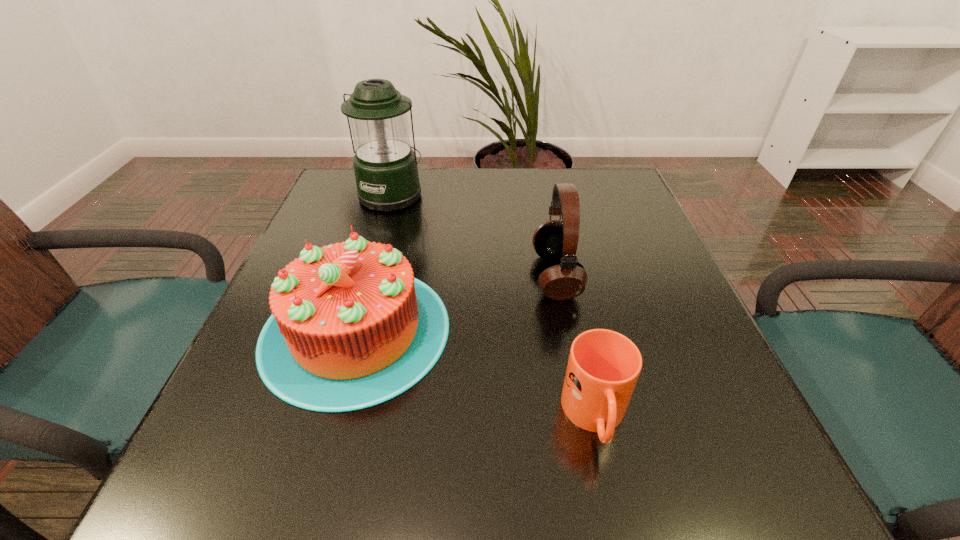
Where is `the tallest object`? the tallest object is located at coordinates (385, 166).

This screenshot has height=540, width=960. Find the location of `lantern`. lantern is located at coordinates pos(385,166).

Locate an element on the screen. headset is located at coordinates (565, 278).

Where is `cake`? The width and height of the screenshot is (960, 540). cake is located at coordinates (351, 328).

Locate an element on the screen. The height and width of the screenshot is (540, 960). the shortest object is located at coordinates (603, 367).

This screenshot has height=540, width=960. In order to click on vacant space located on the front of the farthest object in this screenshot , I will do `click(370, 271)`.

Where is `vacant region located on the ear pads of the headset`? The image size is (960, 540). vacant region located on the ear pads of the headset is located at coordinates pos(402,276).

Where is `vacant space located on the ear pads of the headset`? The height and width of the screenshot is (540, 960). vacant space located on the ear pads of the headset is located at coordinates (421, 276).

Locate an element on the screen. The width and height of the screenshot is (960, 540). free space located on the ear pads of the headset is located at coordinates (358, 276).

Identify the location of vacant area located on the right of the cake. pyautogui.click(x=533, y=330).